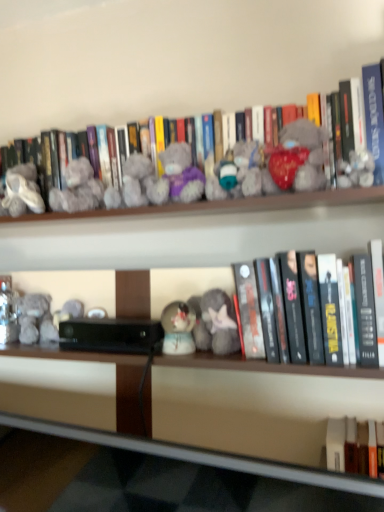
Question: Considering the relative sizes of fluffy gray plush at center, which ranks as the fourth toy in left-to-right order, and black matte book at center, the 2th book positioned from the top, in the image provided, is fluffy gray plush at center, which ranks as the fourth toy in left-to-right order, bigger than black matte book at center, the 2th book positioned from the top,?

Choices:
 (A) no
 (B) yes

Answer: (A)

Question: From the image's perspective, is fluffy gray plush at center, which ranks as the fourth toy in left-to-right order, on black matte book at center, which appears as the 1th book when ordered from the bottom?

Choices:
 (A) no
 (B) yes

Answer: (A)

Question: Is there a large distance between fluffy gray plush at center, which appears as the fourth toy when viewed from the right, and black matte book at center, the 2th book positioned from the top?

Choices:
 (A) yes
 (B) no

Answer: (B)

Question: Is fluffy gray plush at center, which ranks as the fourth toy in left-to-right order, aimed at black matte book at center, which appears as the 1th book when ordered from the bottom?

Choices:
 (A) no
 (B) yes

Answer: (A)

Question: Does fluffy gray plush at center, which appears as the fourth toy when viewed from the right, appear on the right side of black matte book at center, the 2th book positioned from the top?

Choices:
 (A) no
 (B) yes

Answer: (A)

Question: From the image's perspective, is fluffy gray plush at center, which appears as the fourth toy when viewed from the right, below black matte book at center, the 2th book positioned from the top?

Choices:
 (A) yes
 (B) no

Answer: (A)

Question: From the image's perspective, is matte gray plush at upper center, which is the 1th toy from right to left, located above black matte book at center, the 2th book positioned from the top?

Choices:
 (A) no
 (B) yes

Answer: (B)

Question: Is matte gray plush at upper center, which is the 1th toy from right to left, shorter than black matte book at center, which appears as the 1th book when ordered from the bottom?

Choices:
 (A) yes
 (B) no

Answer: (A)

Question: Would you say matte gray plush at upper center, which is the 1th toy from right to left, contains black matte book at center, which appears as the 1th book when ordered from the bottom?

Choices:
 (A) no
 (B) yes

Answer: (A)

Question: Is matte gray plush at upper center, positioned as the 7th toy in left-to-right order, taller than black matte book at center, which appears as the 1th book when ordered from the bottom?

Choices:
 (A) yes
 (B) no

Answer: (B)

Question: From the image's perspective, does matte gray plush at upper center, which is the 1th toy from right to left, appear lower than black matte book at center, which appears as the 1th book when ordered from the bottom?

Choices:
 (A) no
 (B) yes

Answer: (A)

Question: Can you confirm if matte gray plush at upper center, which is the 1th toy from right to left, is smaller than black matte book at center, which appears as the 1th book when ordered from the bottom?

Choices:
 (A) yes
 (B) no

Answer: (A)

Question: Is black matte book at center, the 2th book positioned from the top, looking in the opposite direction of wooden at lower center?

Choices:
 (A) no
 (B) yes

Answer: (A)